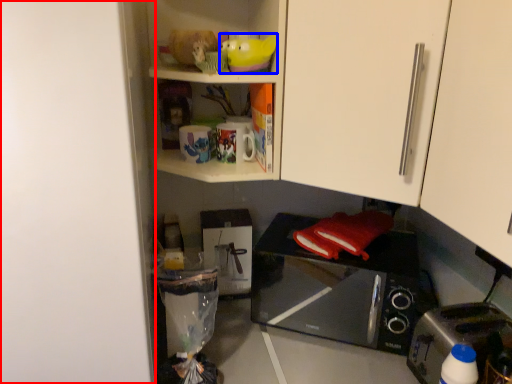
Question: Which object appears farthest to the camera in this image, door (highlighted by a red box) or toy (highlighted by a blue box)?

Choices:
 (A) door
 (B) toy

Answer: (B)